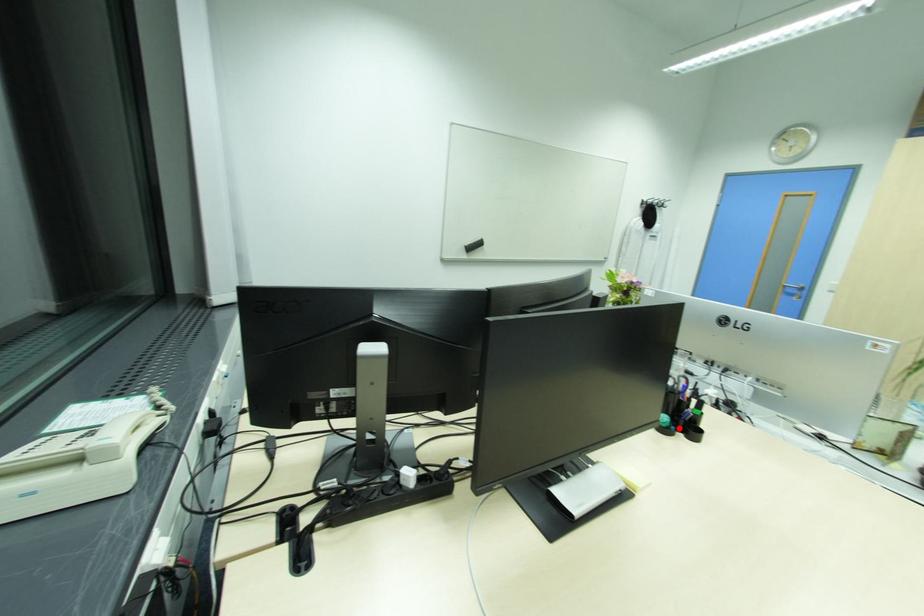
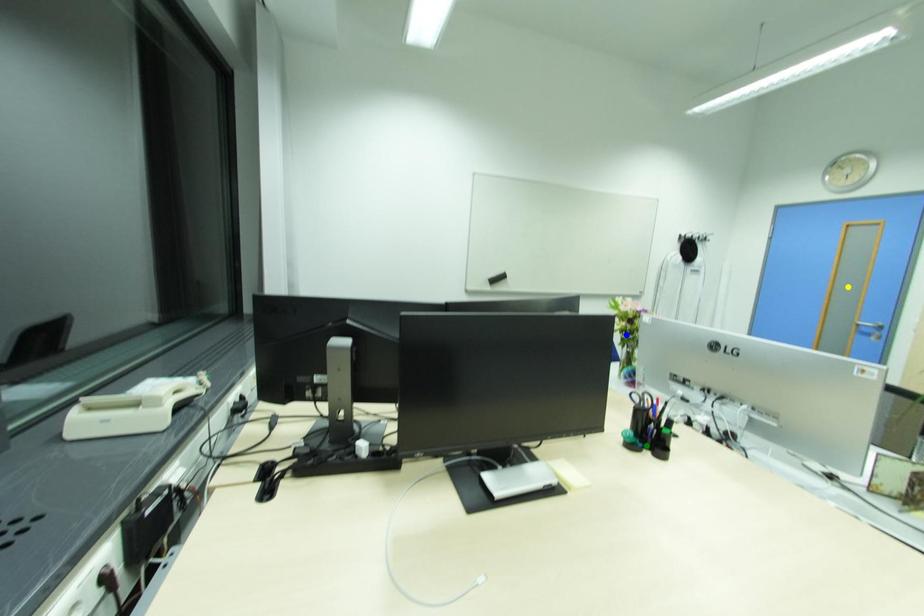
Question: I am providing you with two images of the same scene from different viewpoints. A red point is marked on the first image. You are given multiple points on the second image. Which spot in image 2 lines up with the point in image 1?

Choices:
 (A) blue point
 (B) green point
 (C) yellow point

Answer: (B)